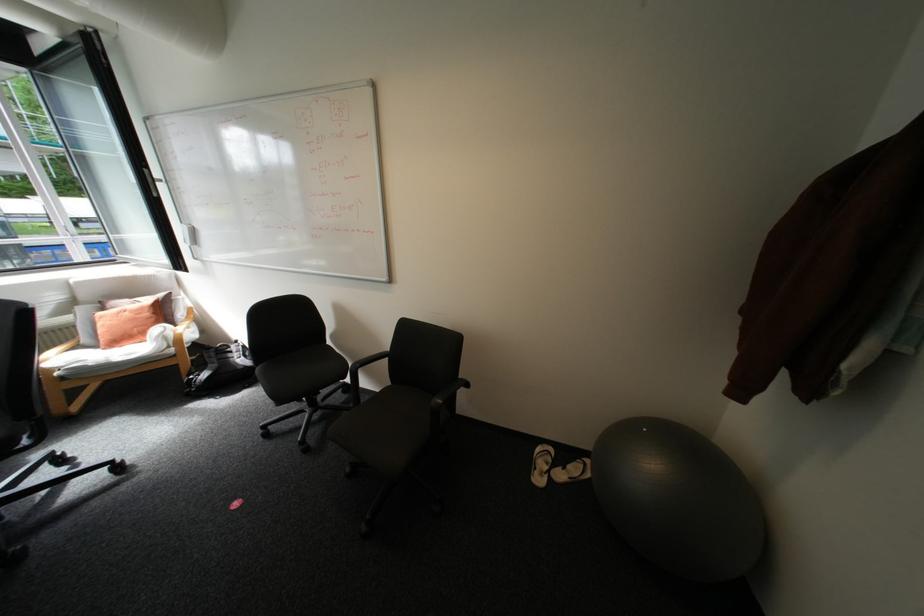
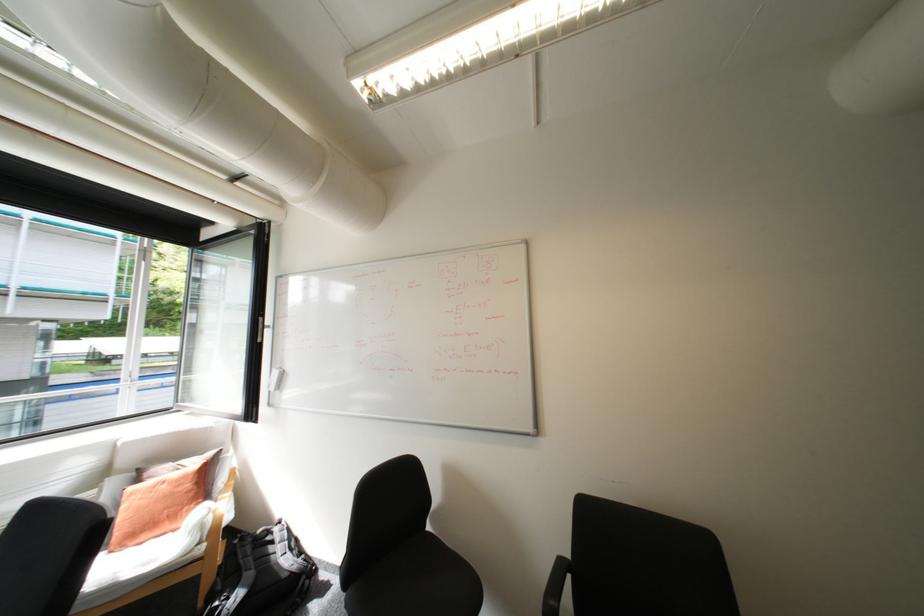
Question: The images are taken continuously from a first-person perspective. In which direction are you moving?

Choices:
 (A) Left
 (B) Right
 (C) Forward
 (D) Backward

Answer: (A)